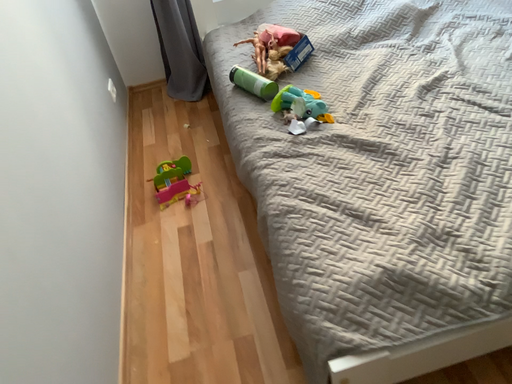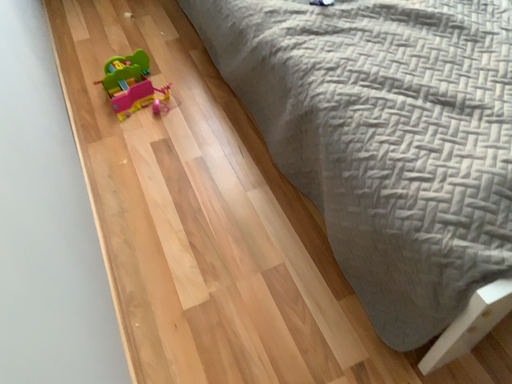
Question: How did the camera likely rotate when shooting the video?

Choices:
 (A) rotated right
 (B) rotated left

Answer: (A)